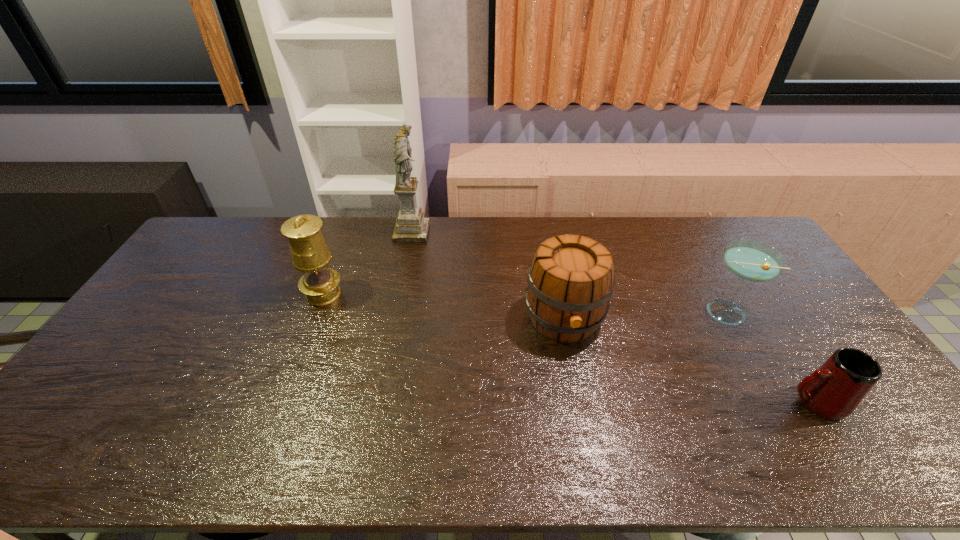
Locate an element on the screen. the closest object to the third object from left to right is located at coordinates (750, 260).

Locate an element on the screen. Image resolution: width=960 pixels, height=540 pixels. vacant area that satisfies the following two spatial constraints: 1. on the front-facing side of the farthest object; 2. on the front side of the leftmost object is located at coordinates (399, 294).

This screenshot has width=960, height=540. In order to click on free space that satisfies the following two spatial constraints: 1. on the front-facing side of the martini; 2. on the left side of the fourth object from right to left in this screenshot , I will do `click(396, 312)`.